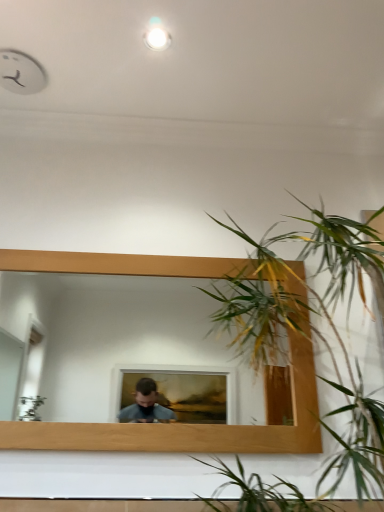
Question: Is point (158, 30) closer or farther from the camera than point (223, 419)?

Choices:
 (A) closer
 (B) farther

Answer: (A)

Question: In the image, is white glossy light at upper center positioned in front of or behind wooden mirror at center?

Choices:
 (A) front
 (B) behind

Answer: (B)

Question: Which is farther from the white glossy light at upper center?

Choices:
 (A) green leafy plant at right
 (B) wooden mirror at center

Answer: (B)

Question: Estimate the real-world distances between objects in this image. Which object is farther from the white glossy light at upper center?

Choices:
 (A) green leafy plant at right
 (B) wooden mirror at center

Answer: (B)